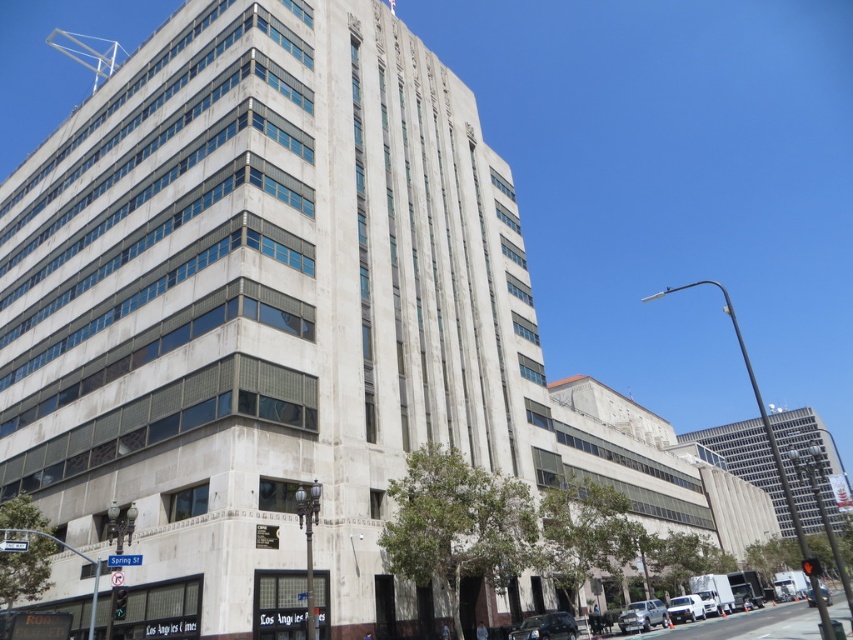
You are a delivery person who needs to park your vehicle in a space that can only accommodate cars narrower than 1.8 meters. You see the silver metallic sedan at lower right and the shiny black sedan at center in the parking lot. Which car should you choose to park in the space?

The silver metallic sedan at lower right has a lesser width compared to the shiny black sedan at center, so you should choose the silver metallic sedan at lower right because it is narrower and can fit into the space.

You are standing in front of the building and want to take a photo. You notice two points marked on the building facade at coordinates point (641, 627) and point (698, 605). Which point is closer to your camera position?

Point (641, 627) is closer to the camera than point (698, 605).